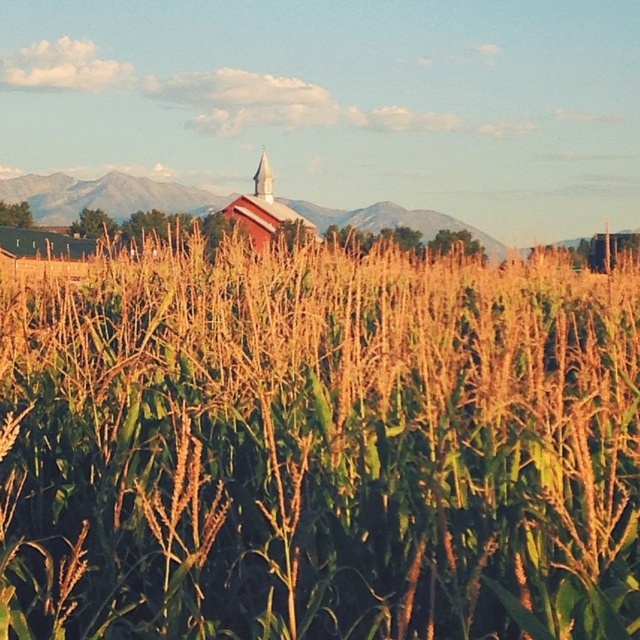
You are a farmer checking the growth of your crops. You notice the green leafy corn at center and the smooth silver spire at center. Which object has a narrower width?

The green leafy corn at center is thinner than the smooth silver spire at center, so the green leafy corn at center has a narrower width.

You are standing in a cornfield and see the matte red barn at center and the smooth silver spire at center. Which object is closer to the ground?

The matte red barn at center is positioned under the smooth silver spire at center, so the matte red barn at center is closer to the ground.